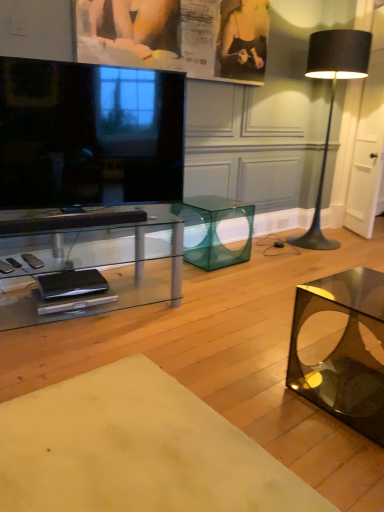
Find the location of a particular element. This screenshot has height=512, width=384. free space above smooth cream fabric at lower center, acting as the 3th table starting from the back (from a real-world perspective) is located at coordinates (136, 450).